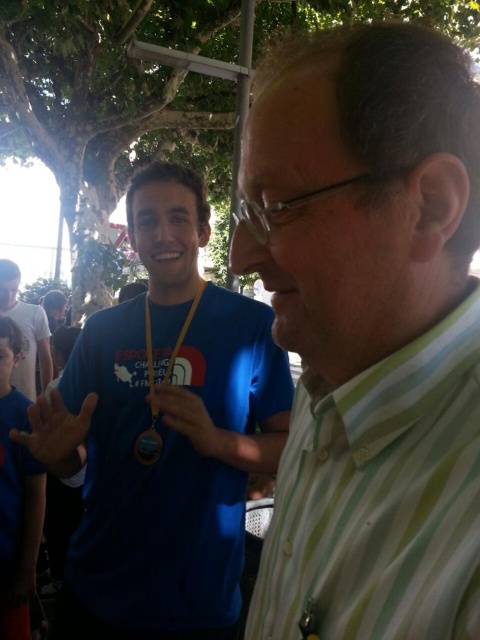
Is point (227, 513) closer to viewer compared to point (140, 461)?

No, it is not.

Is blue fabric shirt at center further to the viewer compared to yellow fabric lanyard at center?

No, blue fabric shirt at center is in front of yellow fabric lanyard at center.

Identify the location of blue fabric shirt at center. This screenshot has height=640, width=480. (168, 435).

Can you confirm if smooth skin hand at center is positioned to the left of matte blue lanyard at center?

Yes, smooth skin hand at center is to the left of matte blue lanyard at center.

Can you confirm if smooth skin hand at center is wider than matte blue lanyard at center?

Indeed, smooth skin hand at center has a greater width compared to matte blue lanyard at center.

Describe the element at coordinates (58, 433) in the screenshot. I see `smooth skin hand at center` at that location.

Locate an element on the screen. This screenshot has width=480, height=640. smooth skin hand at center is located at coordinates (58, 433).

Is point (272, 612) farther from viewer compared to point (194, 416)?

That is False.

Does green striped shirt at center appear on the left side of matte blue lanyard at center?

No, green striped shirt at center is not to the left of matte blue lanyard at center.

Locate an element on the screen. Image resolution: width=480 pixels, height=640 pixels. green striped shirt at center is located at coordinates tap(381, 499).

You are a GUI agent. You are given a task and a screenshot of the screen. Output one action in this format:
    pyautogui.click(x=<x>, y=<y>)
    Task: Click on the green striped shirt at center
    This screenshot has height=640, width=480.
    Given the screenshot: What is the action you would take?
    pyautogui.click(x=381, y=499)